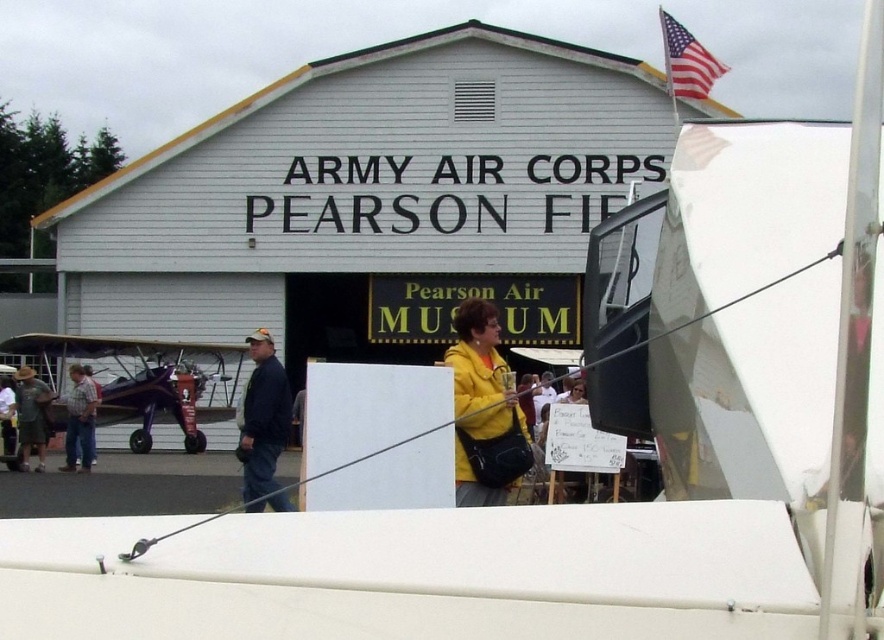
You are standing at the entrance of the museum and want to take a photo of the point at coordinate (x=461, y=470). If your camera has a maximum focus range of 6 meters, will it be able to capture the point clearly?

The distance of point (x=461, y=470) from the viewer is 6.11 meters, which exceeds the camera maximum focus range of 6 meters. Therefore, the camera will not be able to capture the point clearly.

You are a photographer at the museum event and need to capture a photo of both the plaid shirt at left and the dark blue jeans at center. Which clothing item should you focus on first to ensure both are in frame?

The plaid shirt at left is taller than the dark blue jeans at center, so you should focus on the plaid shirt at left first to ensure both are in frame.

You are a photographer trying to capture a clear shot of the yellow matte jacket at center and the dark blue jeans at center. Since you want to ensure both are visible, which clothing item should you focus on first to account for their sizes?

The yellow matte jacket at center has a lesser width compared to dark blue jeans at center, so you should focus on the yellow matte jacket at center first to ensure it is in clear view before adjusting for the larger dark blue jeans at center.